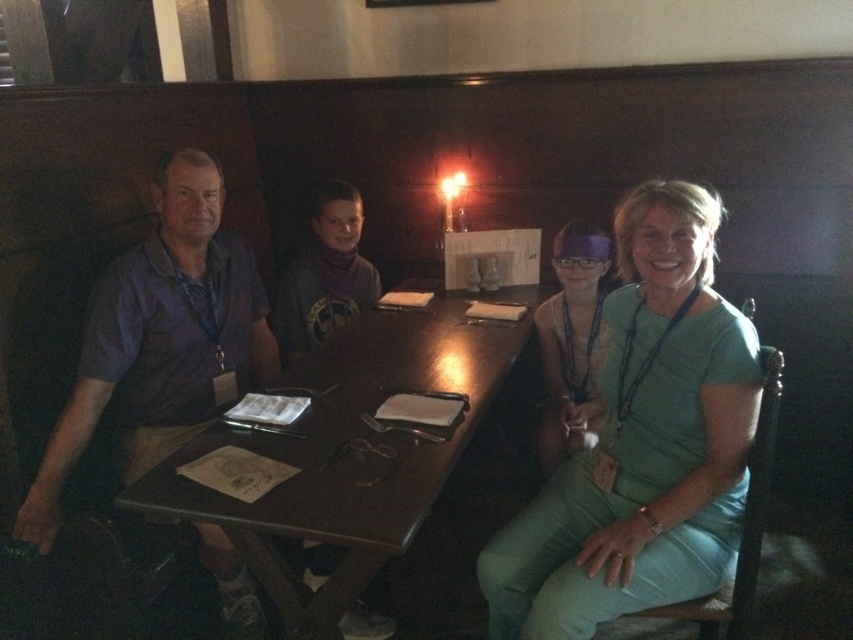
Does dark wood table at center have a greater width compared to green fabric shirt at right?

Yes.

Identify the location of dark wood table at center. The height and width of the screenshot is (640, 853). tap(341, 448).

Can you confirm if green cotton shirt at center is smaller than green fabric shirt at right?

Incorrect, green cotton shirt at center is not smaller in size than green fabric shirt at right.

Who is lower down, green cotton shirt at center or green fabric shirt at right?

green cotton shirt at center is below.

Between point (729, 355) and point (563, 307), which one is positioned behind?

Positioned behind is point (563, 307).

What are the coordinates of `green cotton shirt at center` in the screenshot? It's located at (642, 442).

Who is more distant from viewer, (720, 460) or (326, 250)?

Positioned behind is point (326, 250).

Is green cotton shirt at center to the right of matte green dress at center from the viewer's perspective?

Indeed, green cotton shirt at center is positioned on the right side of matte green dress at center.

This screenshot has width=853, height=640. I want to click on green cotton shirt at center, so click(642, 442).

Find the location of a particular element. The image size is (853, 640). green cotton shirt at center is located at coordinates (642, 442).